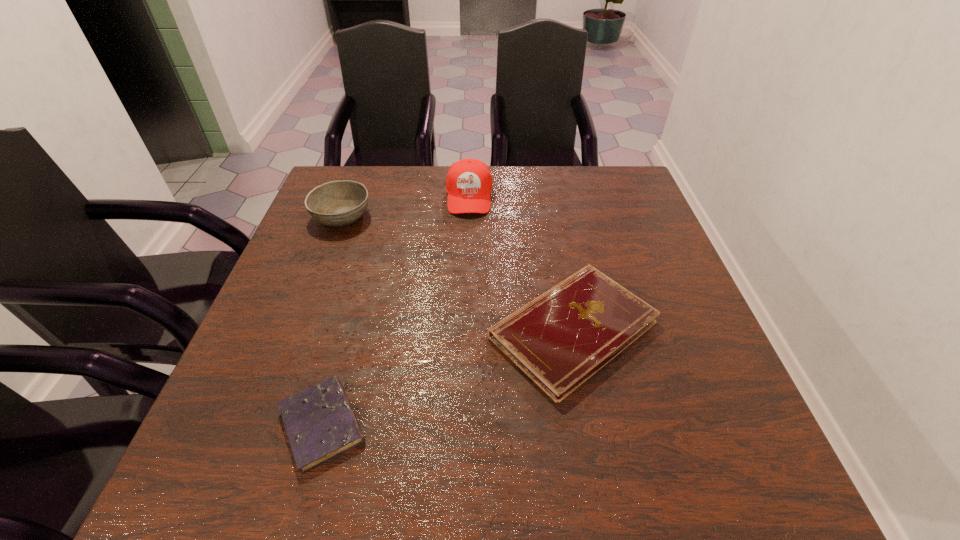
I want to click on vacant position in the image that satisfies the following two spatial constraints: 1. on the front side of the second tallest object; 2. on the left side of the second shortest object, so click(299, 329).